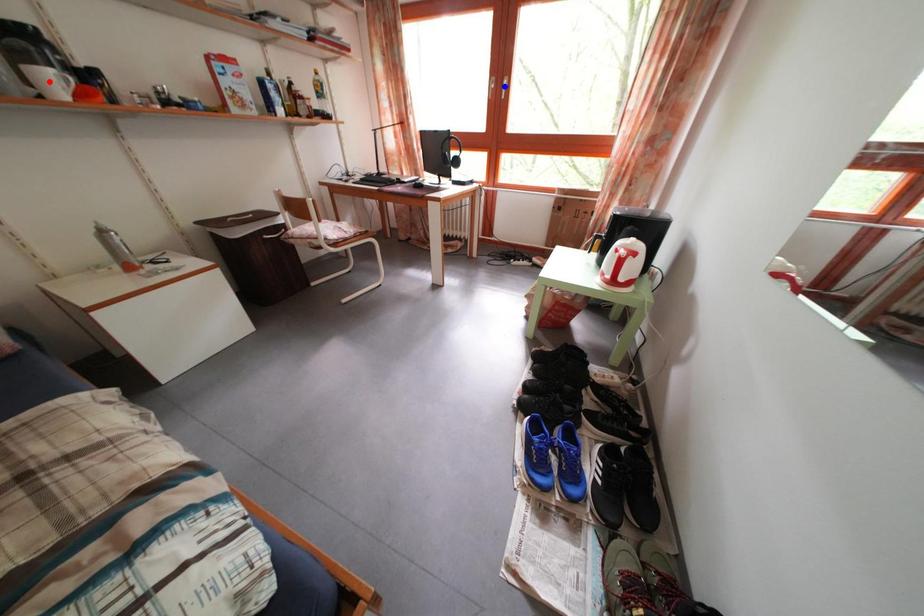
Question: Which of the two points in the image is closer to the camera?

Choices:
 (A) Blue point is closer.
 (B) Red point is closer.

Answer: (B)